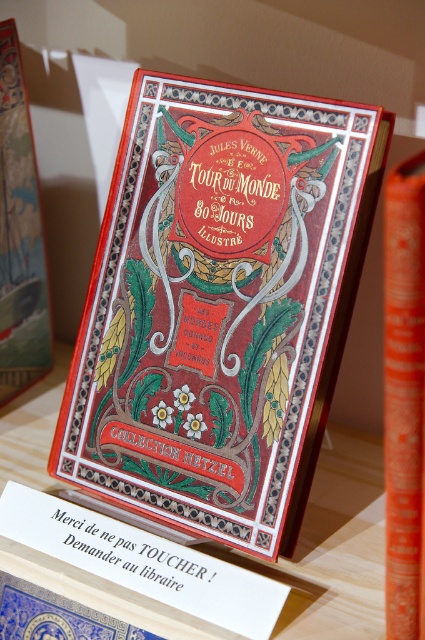
Question: Which of the following is the farthest from the observer?

Choices:
 (A) (71, 592)
 (B) (251, 620)
 (C) (158, 467)

Answer: (C)

Question: Which of the following is the farthest from the observer?

Choices:
 (A) white paper sign at center
 (B) matte red book at center
 (C) matte wood table at center
 (D) orange matte book at center

Answer: (B)

Question: Can you confirm if matte wood table at center is wider than orange matte book at center?

Choices:
 (A) yes
 (B) no

Answer: (A)

Question: From the image, what is the correct spatial relationship of matte wood table at center in relation to white paper sign at center?

Choices:
 (A) right
 (B) left

Answer: (A)

Question: Estimate the real-world distances between objects in this image. Which object is closer to the matte wood table at center?

Choices:
 (A) orange matte book at center
 (B) white paper sign at center
 (C) matte red book at center

Answer: (B)

Question: Does matte red book at center have a smaller size compared to orange matte book at center?

Choices:
 (A) yes
 (B) no

Answer: (B)